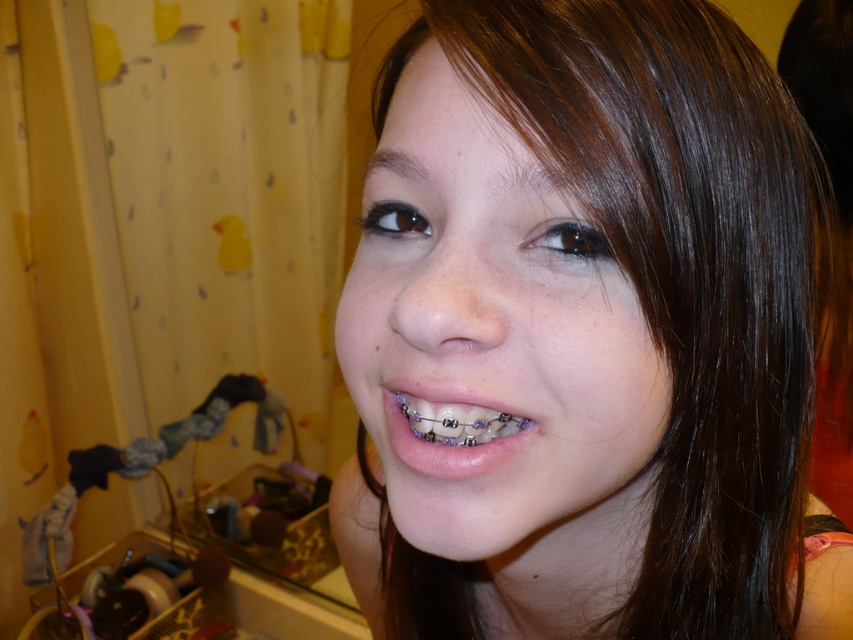
You are a photographer adjusting the focus on your camera. You notice two points in the image at coordinates point (397, 426) and point (451, 417). Which point is closer to the camera lens?

Point (397, 426) is further to the viewer than point (451, 417), so the point closer to the camera lens is point (451, 417).

You are a dentist examining a patient. You need to check the alignment of the purple metallic braces at center and the smooth skin face at center. Which one is positioned lower in the image?

The smooth skin face at center is located below purple metallic braces at center, so the smooth skin face at center is positioned lower in the image.